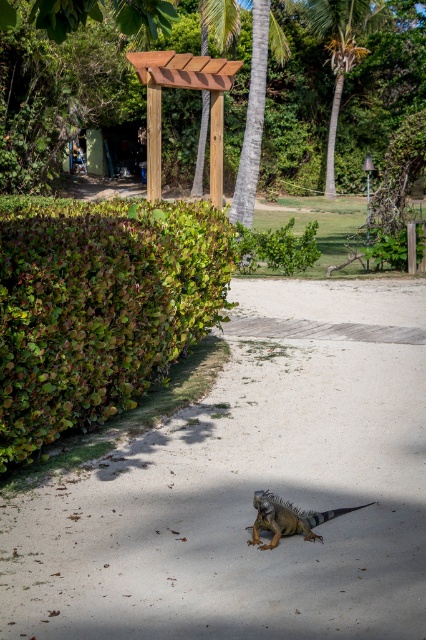
Question: Which object is the farthest from the wooden pergola at upper center?

Choices:
 (A) sandy beige path at center
 (B) green leafy hedge at left

Answer: (A)

Question: Where is wooden pergola at upper center located in relation to green scaly iguana at lower center in the image?

Choices:
 (A) right
 (B) left

Answer: (B)

Question: Which object is the closest to the green leafy hedge at left?

Choices:
 (A) green scaly iguana at lower center
 (B) sandy beige path at center
 (C) green leafy palm tree at upper center

Answer: (B)

Question: Based on their relative distances, which object is nearer to the green leafy palm tree at upper center?

Choices:
 (A) green leafy hedge at left
 (B) green scaly iguana at lower center
 (C) sandy beige path at center
 (D) wooden pergola at upper center

Answer: (D)

Question: Does sandy beige path at center lie behind green leafy hedge at left?

Choices:
 (A) yes
 (B) no

Answer: (B)

Question: Can you confirm if green leafy palm tree at upper center is smaller than green scaly iguana at lower center?

Choices:
 (A) no
 (B) yes

Answer: (A)